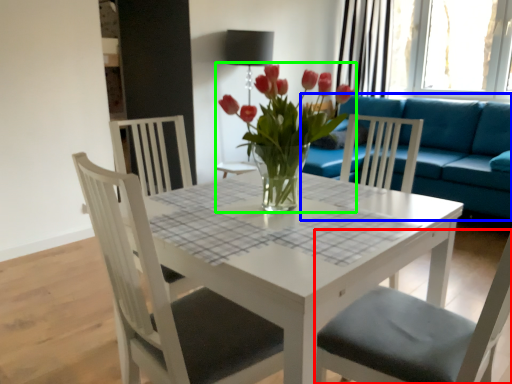
Question: Based on their relative distances, which object is farther from chair (highlighted by a red box)? Choose from studio couch (highlighted by a blue box) and houseplant (highlighted by a green box).

Choices:
 (A) studio couch
 (B) houseplant

Answer: (A)